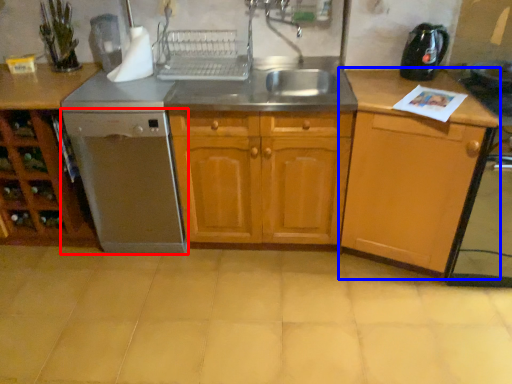
Question: Which object appears farthest to the camera in this image, home appliance (highlighted by a red box) or cabinetry (highlighted by a blue box)?

Choices:
 (A) home appliance
 (B) cabinetry

Answer: (A)